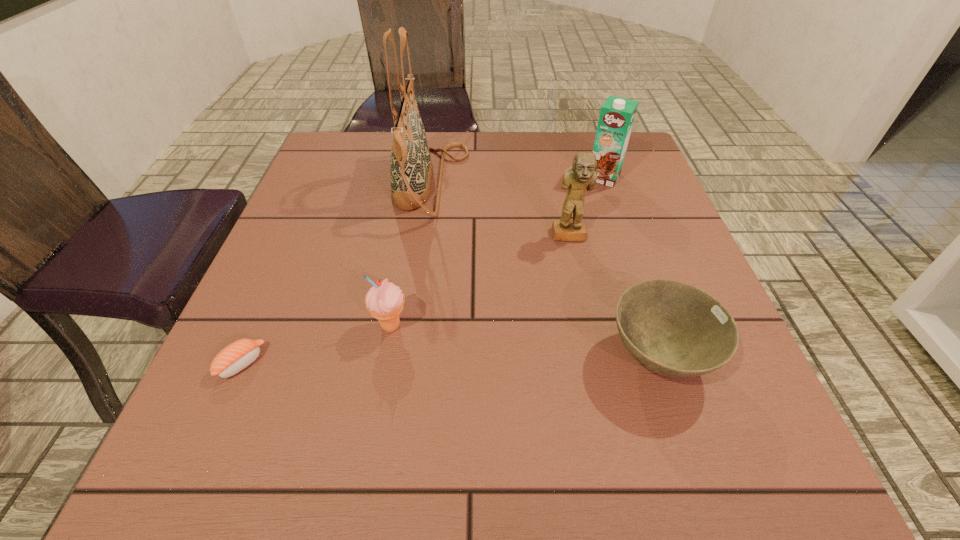
Identify the location of free location located on the left of the icecream. (304, 326).

At what (x,y) coordinates should I click in order to perform the action: click on vacant space located 0.110m on the front of the bowl. Please return your answer as a coordinate pair (x, y). Image resolution: width=960 pixels, height=540 pixels. Looking at the image, I should click on (700, 480).

This screenshot has width=960, height=540. Find the location of `vacant space situated 0.210m on the back of the shortest object`. vacant space situated 0.210m on the back of the shortest object is located at coordinates (287, 260).

Where is `handbag present at the far edge`? Image resolution: width=960 pixels, height=540 pixels. handbag present at the far edge is located at coordinates (411, 168).

Find the location of a particular element. carton situated at the far edge is located at coordinates (617, 115).

Locate an element on the screen. object that is at the left edge is located at coordinates (235, 357).

Identify the location of carton at the right edge. This screenshot has height=540, width=960. (617, 115).

What are the coordinates of `bowl that is at the right edge` in the screenshot? It's located at (672, 328).

The height and width of the screenshot is (540, 960). I want to click on object located at the far right corner, so click(617, 115).

The height and width of the screenshot is (540, 960). Find the location of `vacant space at the far edge of the desktop`. vacant space at the far edge of the desktop is located at coordinates (506, 134).